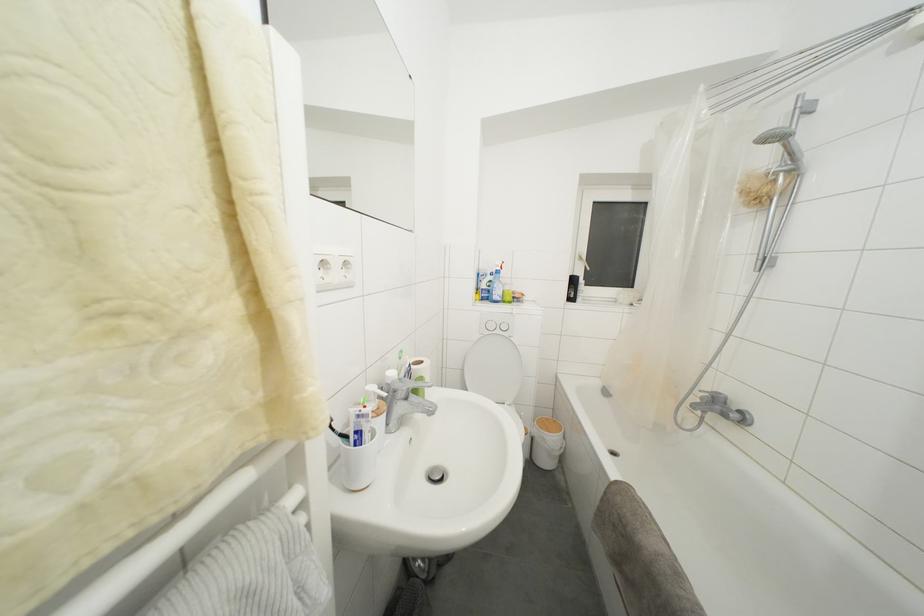
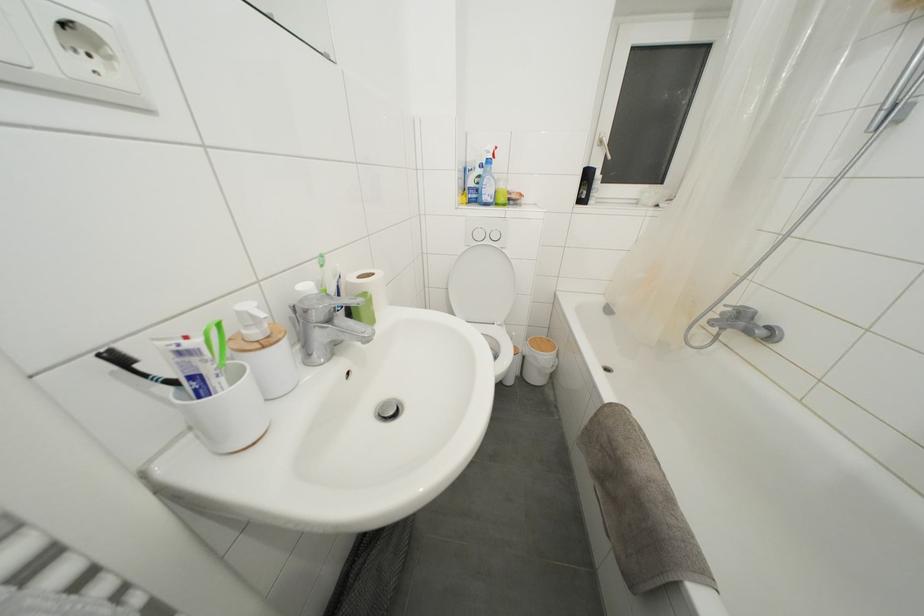
Find the pixel in the second image that matches pixel 552 424 in the first image.

(544, 342)